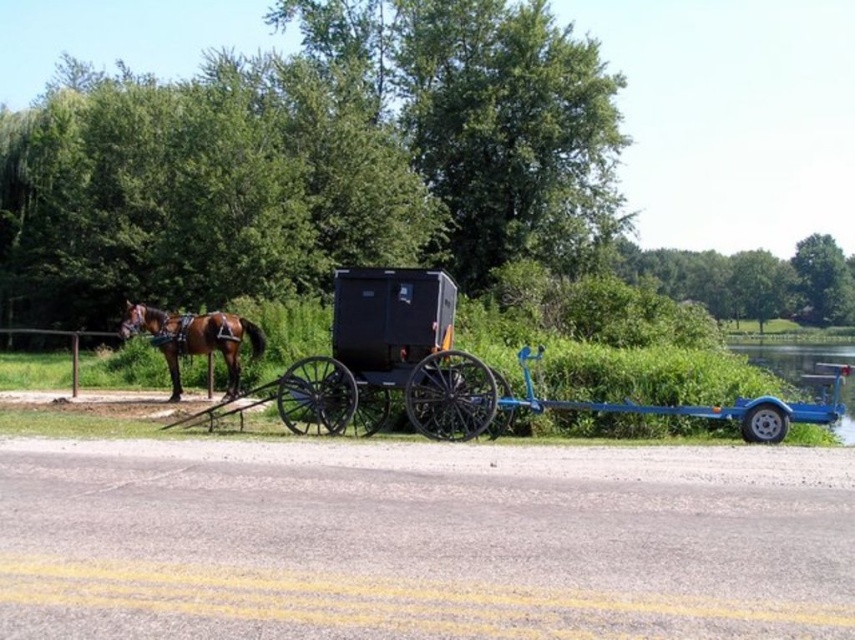
Question: Does black wooden horse cart at center come in front of brown glossy horse at left?

Choices:
 (A) yes
 (B) no

Answer: (A)

Question: Which object is closer to the camera taking this photo?

Choices:
 (A) black wooden horse cart at center
 (B) brown glossy horse at left

Answer: (A)

Question: Which point is closer to the camera taking this photo?

Choices:
 (A) (242, 317)
 (B) (438, 301)

Answer: (B)

Question: Is black wooden horse cart at center wider than brown glossy horse at left?

Choices:
 (A) yes
 (B) no

Answer: (A)

Question: Which of the following is the closest to the observer?

Choices:
 (A) (133, 330)
 (B) (340, 364)

Answer: (B)

Question: Observing the image, what is the correct spatial positioning of black wooden horse cart at center in reference to brown glossy horse at left?

Choices:
 (A) right
 (B) left

Answer: (A)